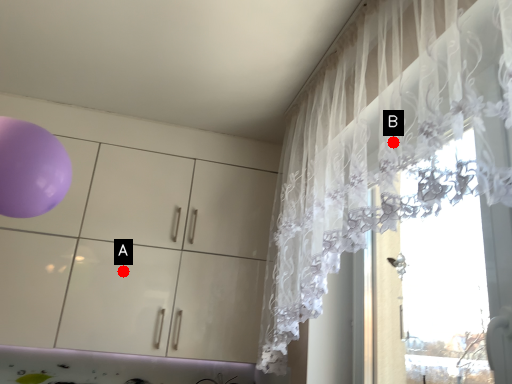
Question: Two points are circled on the image, labeled by A and B beside each circle. Which of the following is the farthest from the observer?

Choices:
 (A) A is further
 (B) B is further

Answer: (A)